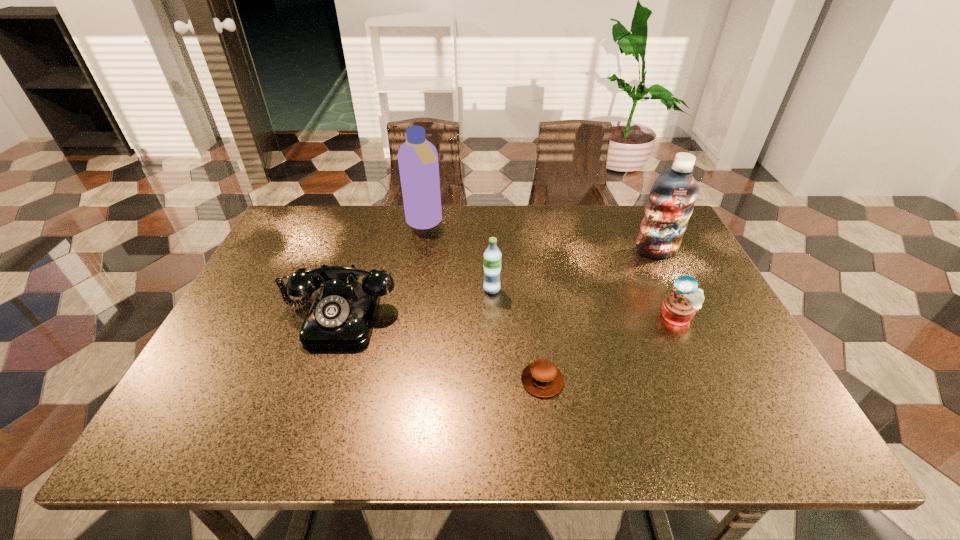
You are a GUI agent. You are given a task and a screenshot of the screen. Output one action in this format:
    pyautogui.click(x=<x>, y=<y>)
    Task: Click on the farthest object
    The width and height of the screenshot is (960, 540).
    Given the screenshot: What is the action you would take?
    point(418,159)

This screenshot has height=540, width=960. What are the coordinates of `the left shampoo` in the screenshot? It's located at 418,159.

What are the coordinates of `the fifth nearest object` in the screenshot? It's located at (671, 201).

Find the location of a particular element. The image size is (960, 540). the nearer shampoo is located at coordinates (671, 201).

Image resolution: width=960 pixels, height=540 pixels. I want to click on the fourth shortest object, so click(x=492, y=256).

Image resolution: width=960 pixels, height=540 pixels. In order to click on water bottle in this screenshot , I will do `click(492, 256)`.

The width and height of the screenshot is (960, 540). I want to click on telephone, so click(341, 316).

What are the coordinates of `the farther muffin` in the screenshot? It's located at (679, 307).

Image resolution: width=960 pixels, height=540 pixels. Identify the location of the taller muffin. (679, 307).

Identify the location of the nearest object. (542, 378).